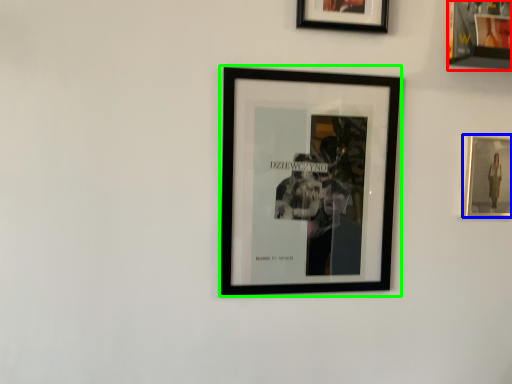
Question: Which object is the farthest from picture frame (highlighted by a red box)? Choose among these: picture frame (highlighted by a blue box) or picture frame (highlighted by a green box).

Choices:
 (A) picture frame
 (B) picture frame

Answer: (B)